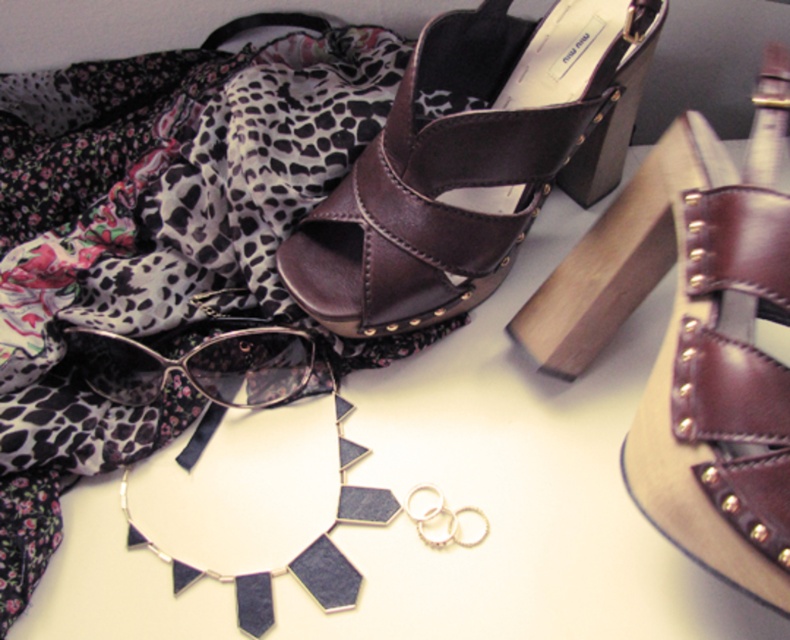
Looking at this image, does brown leather sandal at center appear on the left side of matte black sunglasses at center?

In fact, brown leather sandal at center is to the right of matte black sunglasses at center.

This screenshot has height=640, width=790. Identify the location of brown leather sandal at center. (472, 161).